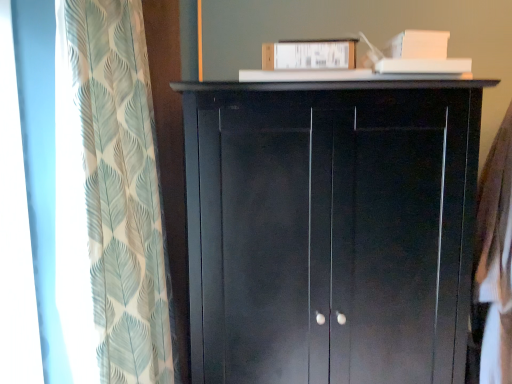
Question: In the image, is translucent leaf-patterned curtain at left on the left side or the right side of matte black cupboard at center?

Choices:
 (A) left
 (B) right

Answer: (A)

Question: From the image's perspective, relative to matte black cupboard at center, is translucent leaf-patterned curtain at left above or below?

Choices:
 (A) below
 (B) above

Answer: (B)

Question: Which object is positioned farthest from the white cotton shirt at right?

Choices:
 (A) translucent leaf-patterned curtain at left
 (B) matte black cupboard at center

Answer: (A)

Question: Which of these objects is positioned farthest from the translucent leaf-patterned curtain at left?

Choices:
 (A) white cotton shirt at right
 (B) matte black cupboard at center

Answer: (A)